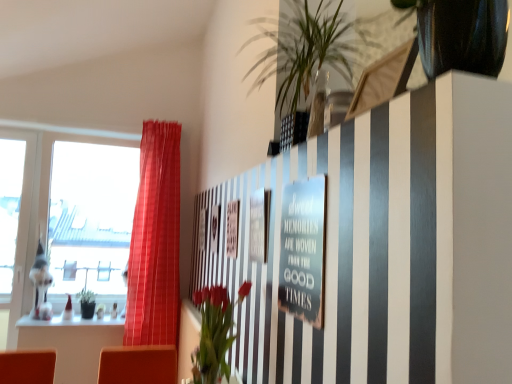
Question: Is metallic silver sign at center not close to vivid red flowers at center?

Choices:
 (A) no
 (B) yes

Answer: (A)

Question: Does metallic silver sign at center have a larger size compared to vivid red flowers at center?

Choices:
 (A) yes
 (B) no

Answer: (B)

Question: From the image's perspective, does metallic silver sign at center appear lower than vivid red flowers at center?

Choices:
 (A) yes
 (B) no

Answer: (B)

Question: Considering the relative sizes of metallic silver sign at center and vivid red flowers at center in the image provided, is metallic silver sign at center smaller than vivid red flowers at center?

Choices:
 (A) no
 (B) yes

Answer: (B)

Question: Is metallic silver sign at center wider than vivid red flowers at center?

Choices:
 (A) yes
 (B) no

Answer: (B)

Question: Would you say vivid red flowers at center is to the left or to the right of transparent glass window at left in the picture?

Choices:
 (A) left
 (B) right

Answer: (B)

Question: Is vivid red flowers at center inside the boundaries of transparent glass window at left, or outside?

Choices:
 (A) inside
 (B) outside

Answer: (B)

Question: Is vivid red flowers at center in front of or behind transparent glass window at left in the image?

Choices:
 (A) behind
 (B) front

Answer: (B)

Question: Is vivid red flowers at center wider or thinner than transparent glass window at left?

Choices:
 (A) thin
 (B) wide

Answer: (A)

Question: Is metallic silver sign at center to the left or to the right of green leafy plant at upper center in the image?

Choices:
 (A) left
 (B) right

Answer: (A)

Question: Is metallic silver sign at center taller or shorter than green leafy plant at upper center?

Choices:
 (A) tall
 (B) short

Answer: (B)

Question: Choose the correct answer: Is metallic silver sign at center inside green leafy plant at upper center or outside it?

Choices:
 (A) outside
 (B) inside

Answer: (A)

Question: Is metallic silver sign at center wider or thinner than green leafy plant at upper center?

Choices:
 (A) wide
 (B) thin

Answer: (B)

Question: Which is correct: matte red curtain at left is inside vivid red flowers at center, or outside of it?

Choices:
 (A) outside
 (B) inside

Answer: (A)

Question: From the image's perspective, is matte red curtain at left above or below vivid red flowers at center?

Choices:
 (A) below
 (B) above

Answer: (B)